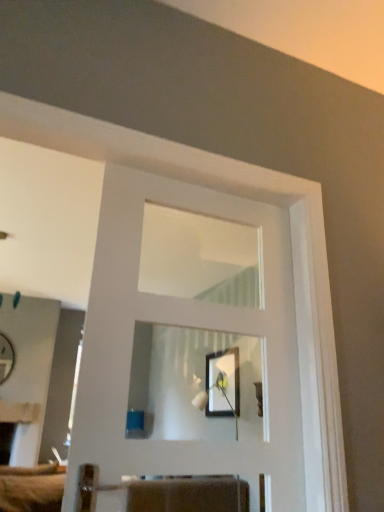
Question: Is white glossy door at center looking in the opposite direction of matte black picture frame at center?

Choices:
 (A) yes
 (B) no

Answer: (B)

Question: Is white glossy door at center facing towards matte black picture frame at center?

Choices:
 (A) yes
 (B) no

Answer: (B)

Question: Does white glossy door at center appear on the right side of matte black picture frame at center?

Choices:
 (A) yes
 (B) no

Answer: (B)

Question: From the image's perspective, is white glossy door at center above matte black picture frame at center?

Choices:
 (A) no
 (B) yes

Answer: (B)

Question: Can you confirm if white glossy door at center is taller than matte black picture frame at center?

Choices:
 (A) yes
 (B) no

Answer: (A)

Question: Can you confirm if white glossy door at center is smaller than matte black picture frame at center?

Choices:
 (A) no
 (B) yes

Answer: (A)

Question: Can you confirm if matte black picture frame at center is taller than white glossy door at center?

Choices:
 (A) no
 (B) yes

Answer: (A)

Question: Is matte black picture frame at center positioned before white glossy door at center?

Choices:
 (A) no
 (B) yes

Answer: (A)

Question: Considering the relative positions of matte black picture frame at center and white glossy door at center in the image provided, is matte black picture frame at center to the right of white glossy door at center from the viewer's perspective?

Choices:
 (A) yes
 (B) no

Answer: (A)

Question: Is matte black picture frame at center next to white glossy door at center?

Choices:
 (A) yes
 (B) no

Answer: (B)

Question: Is white glossy door at center a part of matte black picture frame at center?

Choices:
 (A) no
 (B) yes

Answer: (A)

Question: Can you confirm if matte black picture frame at center is thinner than white glossy door at center?

Choices:
 (A) yes
 (B) no

Answer: (A)

Question: From a real-world perspective, is matte white mirror at left over white glossy door at center?

Choices:
 (A) no
 (B) yes

Answer: (B)